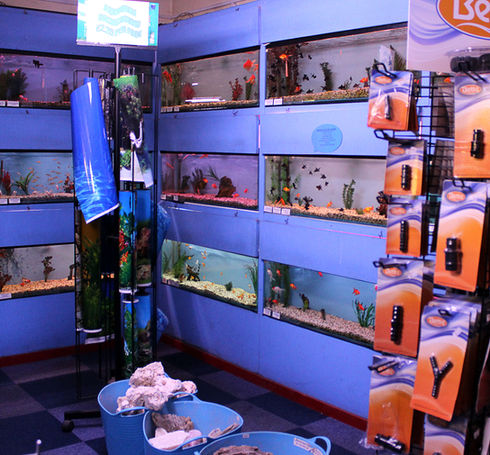
Image resolution: width=490 pixels, height=455 pixels. Find the location of `blue poster`. blue poster is located at coordinates pos(100,179).